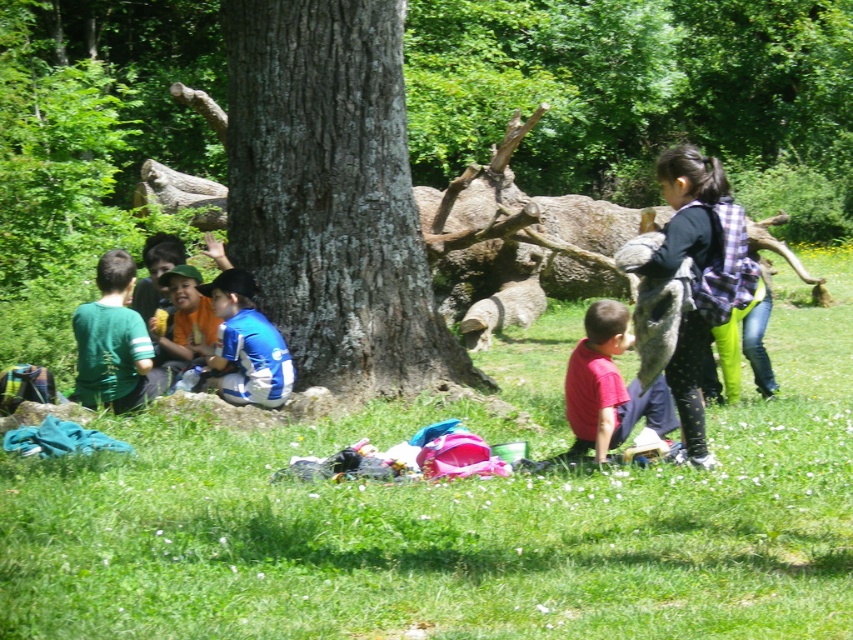
You are a photographer positioned at the edge of the clearing. You want to take a photo that includes both the green matte shirt at left and the blue jersey at center. Based on their positions, which direction should you move to ensure both are in frame?

Since the green matte shirt at left is to the left of the blue jersey at center, you should move to the left to include both in your frame.

You are a photographer standing in the park and you want to take a photo that includes both the red matte shirt at lower center and the blue jersey at center. Based on their positions, which one should you focus on first to ensure both are in the frame?

The red matte shirt at lower center is located below the blue jersey at center, so you should focus on the blue jersey at center first to ensure both are in the frame.

You are a photographer trying to capture a photo of the blue jersey at center and matte orange shirt at center. Which clothing item should you focus on first if you want to ensure both are in the frame without moving the camera?

The blue jersey at center is below the matte orange shirt at center, so focus on the matte orange shirt at center first to ensure the blue jersey at center remains in the frame below it.